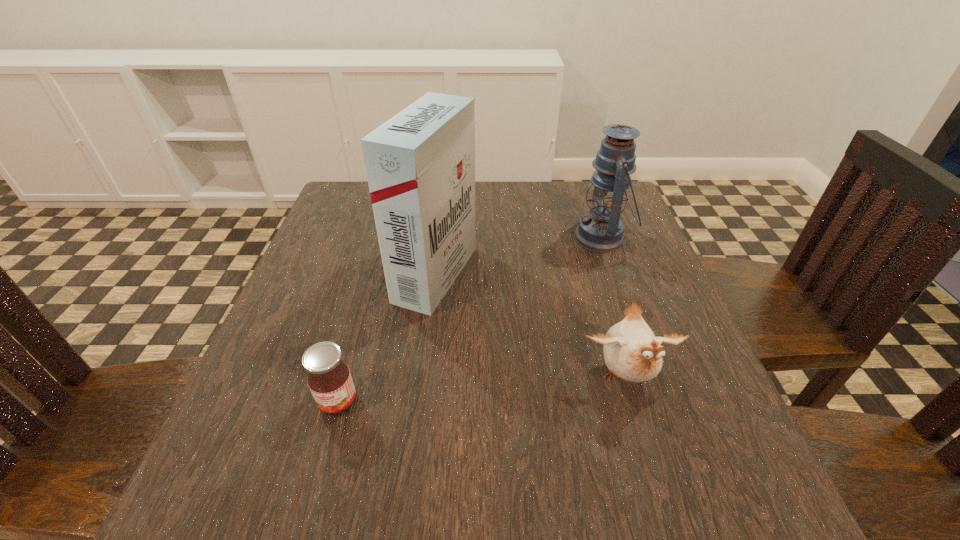
Identify the location of the tallest object. (420, 164).

The image size is (960, 540). I want to click on the second object from left to right, so click(x=420, y=164).

The width and height of the screenshot is (960, 540). Identify the location of the second tallest object. (601, 231).

At what (x,y) coordinates should I click in order to perform the action: click on the second shortest object. Please return your answer as a coordinate pair (x, y). The image size is (960, 540). Looking at the image, I should click on (631, 351).

At what (x,y) coordinates should I click in order to perform the action: click on jam. Please return your answer as a coordinate pair (x, y). The height and width of the screenshot is (540, 960). Looking at the image, I should click on (329, 379).

Image resolution: width=960 pixels, height=540 pixels. I want to click on the shortest object, so click(329, 379).

This screenshot has width=960, height=540. I want to click on free space located 0.210m on the left of the tallest object, so click(x=298, y=274).

Where is `vacant space located 0.160m on the front-facing side of the lantern`? This screenshot has height=540, width=960. vacant space located 0.160m on the front-facing side of the lantern is located at coordinates (507, 238).

This screenshot has width=960, height=540. In order to click on free location located 0.340m on the front-facing side of the lantern in this screenshot , I will do `click(431, 238)`.

Identify the location of vacant space located on the front-facing side of the lantern. (431, 238).